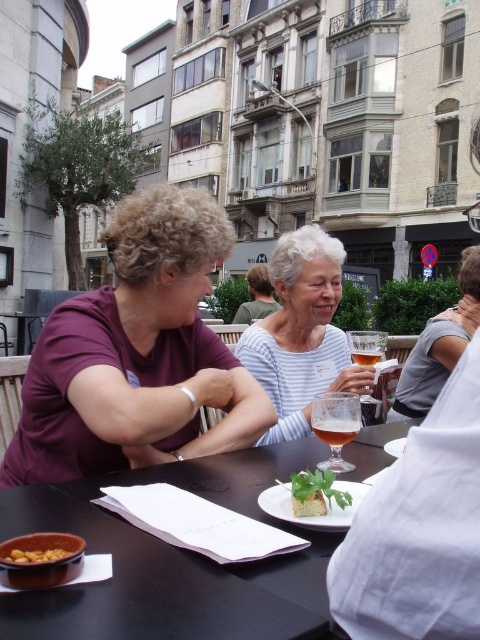
Who is lower down, purple matte shirt at left or green leafy garnish at center?

Positioned lower is green leafy garnish at center.

This screenshot has width=480, height=640. Describe the element at coordinates (136, 355) in the screenshot. I see `purple matte shirt at left` at that location.

The image size is (480, 640). What are the coordinates of `purple matte shirt at left` in the screenshot? It's located at (136, 355).

Is translucent glass beer at center to the right of translucent glass beverage at table center from the viewer's perspective?

No, translucent glass beer at center is not to the right of translucent glass beverage at table center.

Between translucent glass beer at center and translucent glass beverage at table center, which one has less height?

Standing shorter between the two is translucent glass beverage at table center.

Who is more forward, (331, 438) or (352, 349)?

Point (331, 438) is more forward.

Where is `translucent glass beer at center`? The width and height of the screenshot is (480, 640). translucent glass beer at center is located at coordinates (336, 429).

Who is lower down, matte brown bowl at lower left or translucent glass beer at center?

matte brown bowl at lower left is lower down.

What do you see at coordinates (40, 560) in the screenshot?
I see `matte brown bowl at lower left` at bounding box center [40, 560].

Is point (22, 586) positioned before point (347, 432)?

That is True.

The image size is (480, 640). Identify the location of matte brown bowl at lower left. (40, 560).